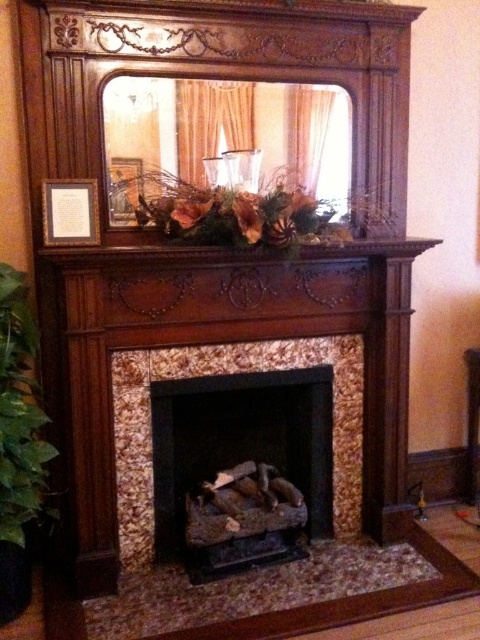
You are planning to place a new decorative item on the wooden mantel at upper center. Considering the green leafy plant at left is already there, which object has more space available for placement?

The wooden mantel at upper center has more space available for placement because the green leafy plant at left has a lesser width compared to it.

You are standing in front of the fireplace and want to water the green leafy plant at left. If your watering can has a maximum reach of 1.8 meters, will you be able to water the plant without moving closer?

The green leafy plant at left is 2.02 meters away from the viewer. Since the watering can only reaches up to 1.8 meters, you won not be able to water the plant without moving closer.

You are standing in front of the fireplace and want to place a new decoration on the mantel. The mantel is 1.2 meters wide. The green leafy plant at left is currently occupying part of the mantel. Can you estimate how much space is left on the mantel for the new decoration?

The green leafy plant at left is positioned at point (20, 413) on the mantel. Assuming the mantel is 1.2 meters wide, the remaining space available for the new decoration would be approximately 0.43 meters. This calculation is based on the plant occupying about 0.77 meters of the mantel length, leaving roughly 0.43 meters of space remaining.